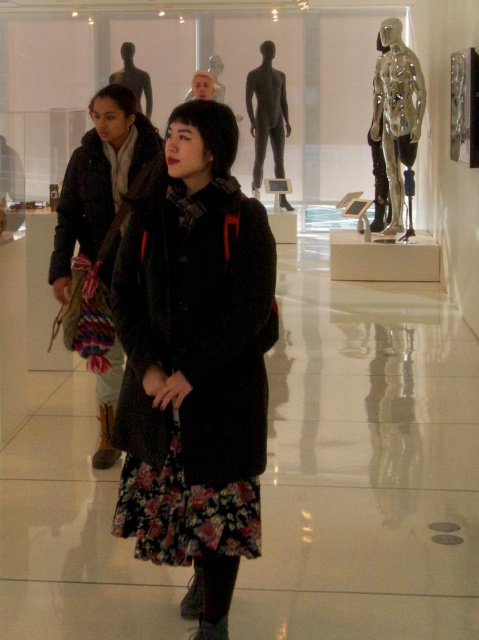
Is point (148, 150) positioned after point (276, 156)?

No, it is in front of (276, 156).

The image size is (479, 640). Describe the element at coordinates (102, 186) in the screenshot. I see `matte black coat at center` at that location.

Is point (82, 168) positioned after point (281, 100)?

No, (82, 168) is in front of (281, 100).

Locate an element on the screen. The height and width of the screenshot is (640, 479). matte black coat at center is located at coordinates (102, 186).

From the picture: Can you confirm if floral skirt at center is wider than matte black mannequin at center?

No, floral skirt at center is not wider than matte black mannequin at center.

Consider the image. Is floral skirt at center smaller than matte black mannequin at center?

Correct, floral skirt at center occupies less space than matte black mannequin at center.

The height and width of the screenshot is (640, 479). What do you see at coordinates (194, 364) in the screenshot?
I see `floral skirt at center` at bounding box center [194, 364].

The image size is (479, 640). In order to click on floral skirt at center in this screenshot , I will do click(194, 364).

Is the position of floral skirt at center less distant than that of matte black coat at center?

Yes, it is in front of matte black coat at center.

Who is more distant from viewer, [228,333] or [64,228]?

The point [64,228] is behind.

The image size is (479, 640). What are the coordinates of `floral skirt at center` in the screenshot? It's located at (194, 364).